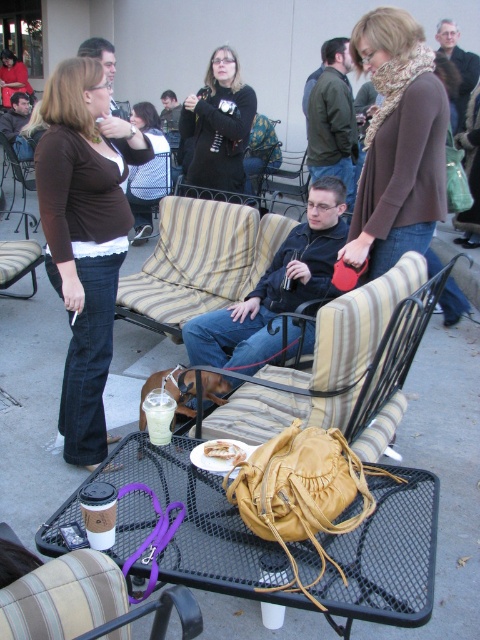
Question: Can you confirm if leather bag at center is bigger than dark brown leather jacket at center?

Choices:
 (A) no
 (B) yes

Answer: (A)

Question: Does matte black sweater at center have a smaller size compared to striped fabric chair at center?

Choices:
 (A) no
 (B) yes

Answer: (B)

Question: In this image, where is matte black sweater at center located relative to matte black shirt at center?

Choices:
 (A) right
 (B) left

Answer: (A)

Question: Which of the following is the closest to the observer?

Choices:
 (A) matte black shirt at center
 (B) brown soft shirt at left
 (C) matte black jacket at center

Answer: (B)

Question: Which object is positioned farthest from the leather-like beige armchair at center?

Choices:
 (A) dark brown leather jacket at center
 (B) green matte jacket at center
 (C) knit scarf at center
 (D) matte black shirt at upper left

Answer: (D)

Question: Which is farther from the striped fabric chair at center?

Choices:
 (A) matte black sweater at center
 (B) knit scarf at center
 (C) white paper bag at center

Answer: (C)